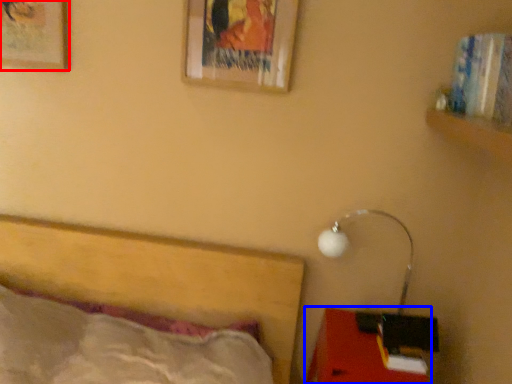
Question: Which point is closer to the camera, picture frame (highlighted by a red box) or furniture (highlighted by a blue box)?

Choices:
 (A) picture frame
 (B) furniture

Answer: (B)